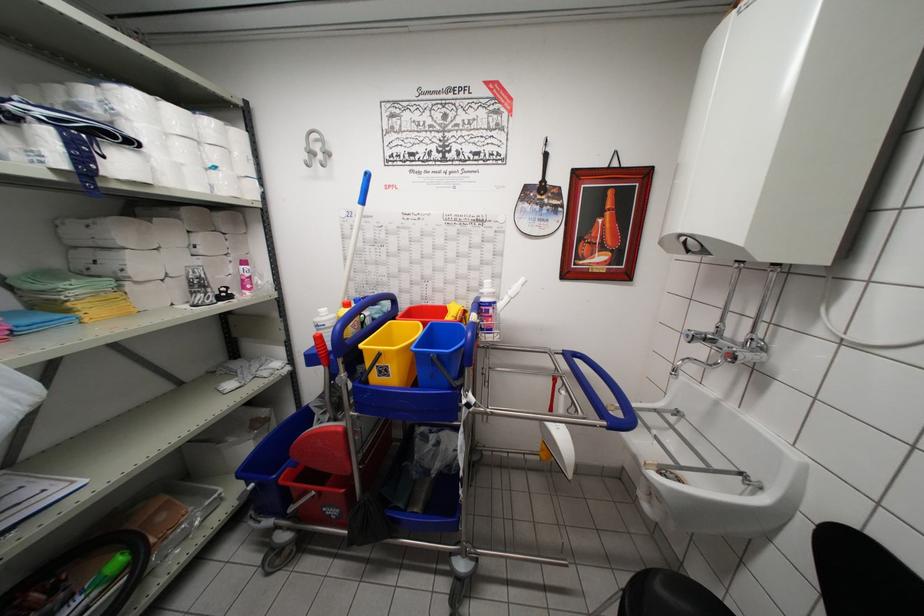
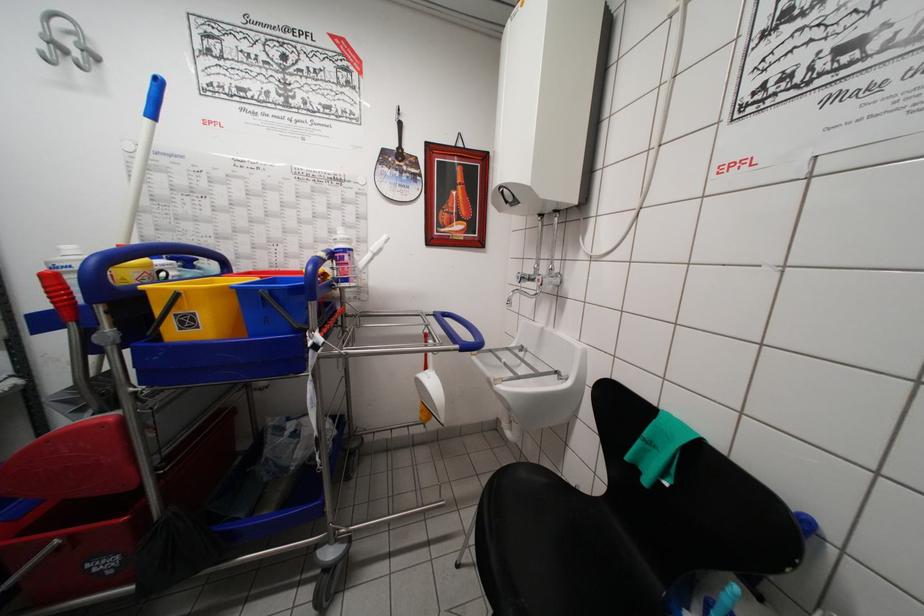
Locate, in the second image, the point that corresponds to point (381, 286) in the first image.

(203, 249)